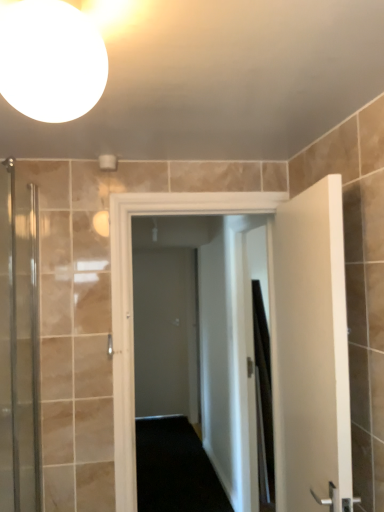
Identify the location of white matte door at right, which appears as the 1th door when viewed from the right. Image resolution: width=384 pixels, height=512 pixels. (311, 353).

This screenshot has width=384, height=512. What do you see at coordinates (270, 334) in the screenshot?
I see `white glossy door at center, placed as the second door when sorted from right to left` at bounding box center [270, 334].

The height and width of the screenshot is (512, 384). I want to click on white matte door at right, the 2th door from the left, so click(311, 353).

Is white glossy sphere at upper left aimed at white glossy door at center, which ranks as the 1th door in left-to-right order?

No, white glossy sphere at upper left is not aimed at white glossy door at center, which ranks as the 1th door in left-to-right order.

Can you confirm if white glossy sphere at upper left is wider than white glossy door at center, placed as the second door when sorted from right to left?

Yes, white glossy sphere at upper left is wider than white glossy door at center, placed as the second door when sorted from right to left.

Which object is closer to the camera, white glossy sphere at upper left or white glossy door at center, placed as the second door when sorted from right to left?

white glossy sphere at upper left.

Is white glossy sphere at upper left situated inside white glossy door at center, which ranks as the 1th door in left-to-right order, or outside?

white glossy sphere at upper left lies outside white glossy door at center, which ranks as the 1th door in left-to-right order.

In the scene shown: Considering the relative sizes of clear glass shower door at left and white glossy door at center, placed as the second door when sorted from right to left, in the image provided, is clear glass shower door at left thinner than white glossy door at center, placed as the second door when sorted from right to left,?

Yes.

Does clear glass shower door at left touch white glossy door at center, placed as the second door when sorted from right to left?

No.

Relative to gray matte door at center, is clear glass shower door at left in front or behind?

Visually, clear glass shower door at left is located in front of gray matte door at center.

This screenshot has width=384, height=512. What are the coordinates of `shower door on the left of the gray matte door at center` in the screenshot? It's located at (19, 343).

Based on the photo, is clear glass shower door at left beside gray matte door at center?

They are not placed beside each other.

Is gray matte door at center at the back of clear glass shower door at left?

No, clear glass shower door at left is not facing away from gray matte door at center.

From the image's perspective, which one is positioned higher, black fabric shower curtain at right or white matte door at right, which appears as the 1th door when viewed from the right?

From the image's view, white matte door at right, which appears as the 1th door when viewed from the right, is above.

I want to click on the 2nd door positioned above the black fabric shower curtain at right (from the image's perspective), so click(311, 353).

Considering their positions, is black fabric shower curtain at right located in front of or behind white matte door at right, the 2th door from the left?

black fabric shower curtain at right is behind white matte door at right, the 2th door from the left.

Is black fabric shower curtain at right shorter than white matte door at right, the 2th door from the left?

Yes, black fabric shower curtain at right is shorter than white matte door at right, the 2th door from the left.

Looking at this image, from the image's perspective, is gray matte door at center below clear glass shower door at left?

Yes, from the image's perspective, gray matte door at center is beneath clear glass shower door at left.

Does gray matte door at center touch clear glass shower door at left?

gray matte door at center is not next to clear glass shower door at left, and they're not touching.

I want to click on shower door that appears on the left of gray matte door at center, so click(19, 343).

Is the position of white glossy sphere at upper left less distant than that of clear glass shower door at left?

Yes, white glossy sphere at upper left is in front of clear glass shower door at left.

From the image's perspective, would you say white glossy sphere at upper left is positioned over clear glass shower door at left?

Yes, from the image's perspective, white glossy sphere at upper left is on top of clear glass shower door at left.

Is clear glass shower door at left completely or partially inside white glossy sphere at upper left?

No, clear glass shower door at left is not surrounded by white glossy sphere at upper left.

Does white glossy sphere at upper left have a larger size compared to clear glass shower door at left?

Actually, white glossy sphere at upper left might be smaller than clear glass shower door at left.

Consider the image. Considering the relative sizes of white glossy door at center, placed as the second door when sorted from right to left, and white glossy sphere at upper left in the image provided, is white glossy door at center, placed as the second door when sorted from right to left, taller than white glossy sphere at upper left?

Yes, white glossy door at center, placed as the second door when sorted from right to left, is taller than white glossy sphere at upper left.

From the image's perspective, who appears lower, white glossy door at center, which ranks as the 1th door in left-to-right order, or white glossy sphere at upper left?

white glossy door at center, which ranks as the 1th door in left-to-right order, from the image's perspective.

Are white glossy door at center, placed as the second door when sorted from right to left, and white glossy sphere at upper left making contact?

No, white glossy door at center, placed as the second door when sorted from right to left, is not touching white glossy sphere at upper left.

From a real-world perspective, is white glossy door at center, placed as the second door when sorted from right to left, beneath white glossy sphere at upper left?

Indeed, from a real-world perspective, white glossy door at center, placed as the second door when sorted from right to left, is positioned beneath white glossy sphere at upper left.

What are the coordinates of `light fixture that is above the white glossy door at center, which ranks as the 1th door in left-to-right order (from the image's perspective)` in the screenshot? It's located at (51, 61).

I want to click on shower door lying on the left of white glossy door at center, placed as the second door when sorted from right to left, so click(x=19, y=343).

Considering their positions, is gray matte door at center positioned closer to white glossy sphere at upper left than black fabric shower curtain at right?

black fabric shower curtain at right is positioned closer to the anchor white glossy sphere at upper left.

Estimate the real-world distances between objects in this image. Which object is further from black fabric shower curtain at right, white matte door at right, which appears as the 1th door when viewed from the right, or gray matte door at center?

white matte door at right, which appears as the 1th door when viewed from the right.

When comparing their distances from gray matte door at center, does white glossy door at center, placed as the second door when sorted from right to left, or white matte door at right, the 2th door from the left, seem closer?

Among the two, white glossy door at center, placed as the second door when sorted from right to left, is located nearer to gray matte door at center.

When comparing their distances from white glossy door at center, which ranks as the 1th door in left-to-right order, does white glossy sphere at upper left or black fabric shower curtain at right seem further?

black fabric shower curtain at right is positioned further to the anchor white glossy door at center, which ranks as the 1th door in left-to-right order.

Based on the photo, looking at the image, which one is located further to gray matte door at center, white glossy door at center, which ranks as the 1th door in left-to-right order, or white glossy sphere at upper left?

white glossy sphere at upper left is further to gray matte door at center.

Looking at the image, which one is located closer to white glossy sphere at upper left, white matte door at right, which appears as the 1th door when viewed from the right, or gray matte door at center?

white matte door at right, which appears as the 1th door when viewed from the right, lies closer to white glossy sphere at upper left than the other object.

Based on their spatial positions, is white matte door at right, which appears as the 1th door when viewed from the right, or white glossy door at center, placed as the second door when sorted from right to left, closer to black fabric shower curtain at right?

white glossy door at center, placed as the second door when sorted from right to left, lies closer to black fabric shower curtain at right than the other object.

Considering their positions, is white glossy door at center, which ranks as the 1th door in left-to-right order, positioned further to clear glass shower door at left than black fabric shower curtain at right?

black fabric shower curtain at right is further to clear glass shower door at left.

Where is `door between clear glass shower door at left and white matte door at right, the 2th door from the left, from left to right`? The height and width of the screenshot is (512, 384). door between clear glass shower door at left and white matte door at right, the 2th door from the left, from left to right is located at coordinates (270, 334).

The image size is (384, 512). Identify the location of door between white matte door at right, the 2th door from the left, and black fabric shower curtain at right, along the z-axis. (270, 334).

Where is `shower door between white glossy sphere at upper left and white glossy door at center, placed as the second door when sorted from right to left, along the z-axis`? The width and height of the screenshot is (384, 512). shower door between white glossy sphere at upper left and white glossy door at center, placed as the second door when sorted from right to left, along the z-axis is located at coordinates (19, 343).

This screenshot has width=384, height=512. In order to click on shower curtain between white matte door at right, the 2th door from the left, and gray matte door at center in the front-back direction in this screenshot , I will do `click(263, 400)`.